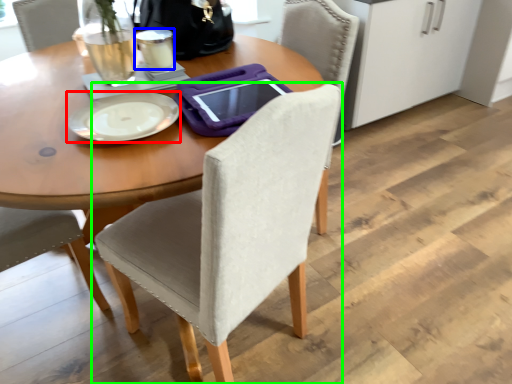
Question: Which object is the closest to the plate (highlighted by a red box)? Choose among these: coffee cup (highlighted by a blue box) or chair (highlighted by a green box).

Choices:
 (A) coffee cup
 (B) chair

Answer: (A)